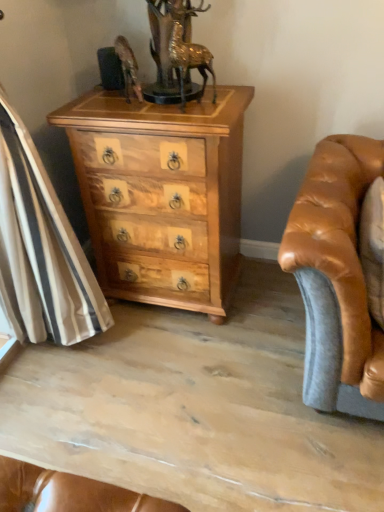
You are a GUI agent. You are given a task and a screenshot of the screen. Output one action in this format:
    pyautogui.click(x=<x>, y=<y>)
    Task: Click on the free point to the right of gold metallic deer at upper center
    The height and width of the screenshot is (512, 384).
    Given the screenshot: What is the action you would take?
    pyautogui.click(x=228, y=103)